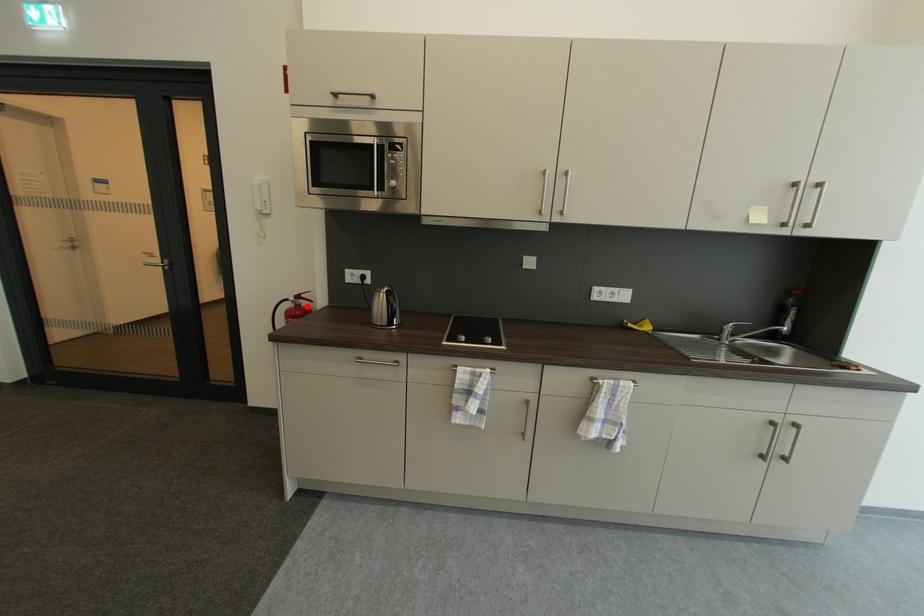
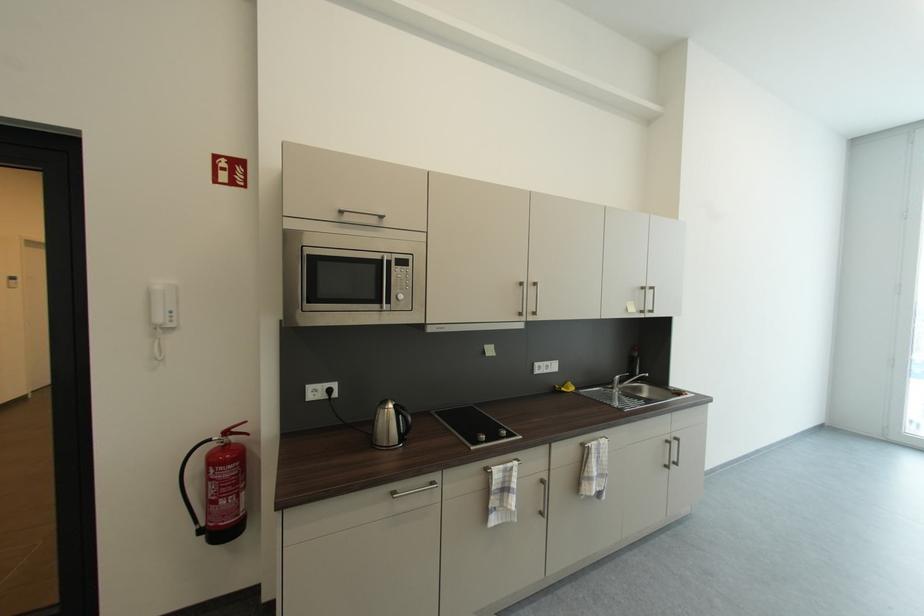
Where in the second image is the point corresponding to the highlighted location from the first image?

(237, 444)